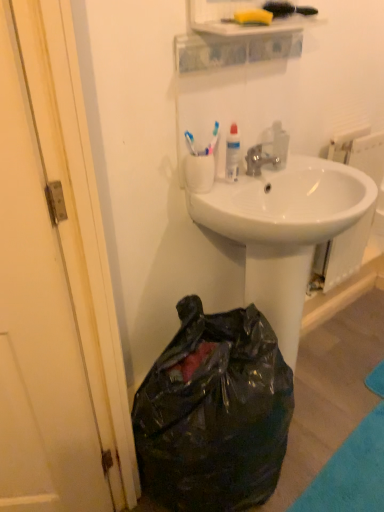
I want to click on free spot in front of white plastic cup at upper center, so click(223, 202).